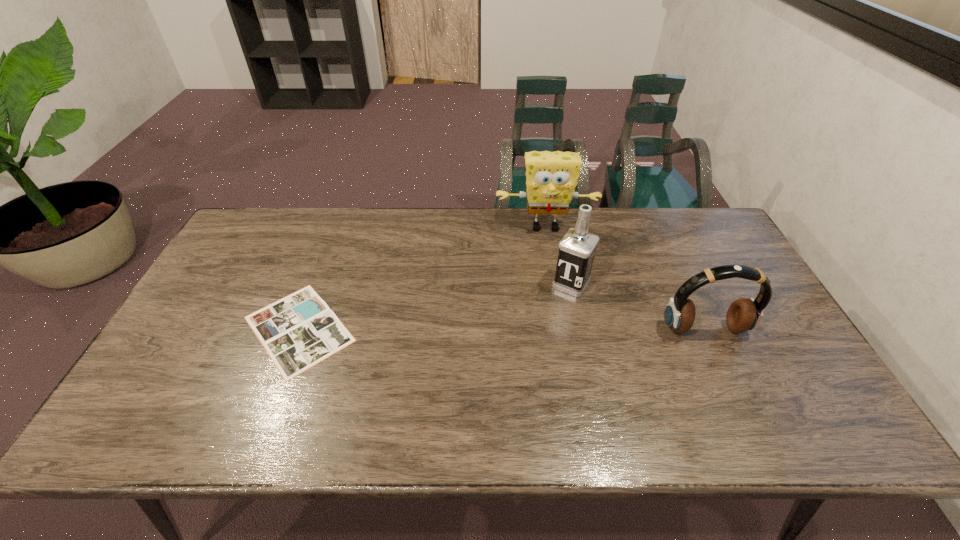
Find the location of a particular element. Image resolution: width=960 pixels, height=540 pixels. vacant area between the rightmost object and the vodka is located at coordinates (637, 307).

You are a GUI agent. You are given a task and a screenshot of the screen. Output one action in this format:
    pyautogui.click(x=<x>, y=<y>)
    Task: Click on the free space that is in between the shortest object and the second shortest object
    Image resolution: width=960 pixels, height=540 pixels.
    Given the screenshot: What is the action you would take?
    pyautogui.click(x=502, y=329)

The height and width of the screenshot is (540, 960). What are the coordinates of `object that stands as the second closest to the shortest object` in the screenshot? It's located at (577, 248).

The image size is (960, 540). I want to click on object that is the closest to the book, so click(551, 177).

At what (x,y) coordinates should I click in order to perform the action: click on free point that satisfies the following two spatial constraints: 1. on the back side of the farthest object; 2. on the left side of the leftmost object. Please return your answer as a coordinate pair (x, y). This screenshot has width=960, height=540. Looking at the image, I should click on (338, 227).